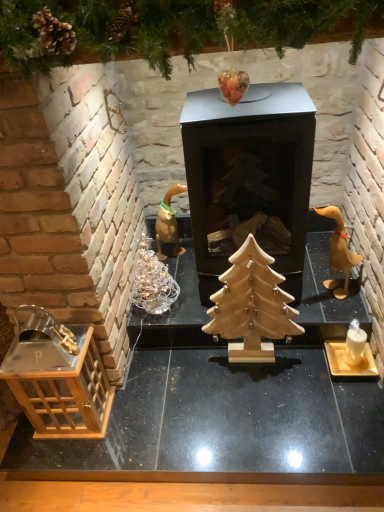
Where is `free spot in front of matte gold candle holder at lower right`? free spot in front of matte gold candle holder at lower right is located at coordinates (352, 403).